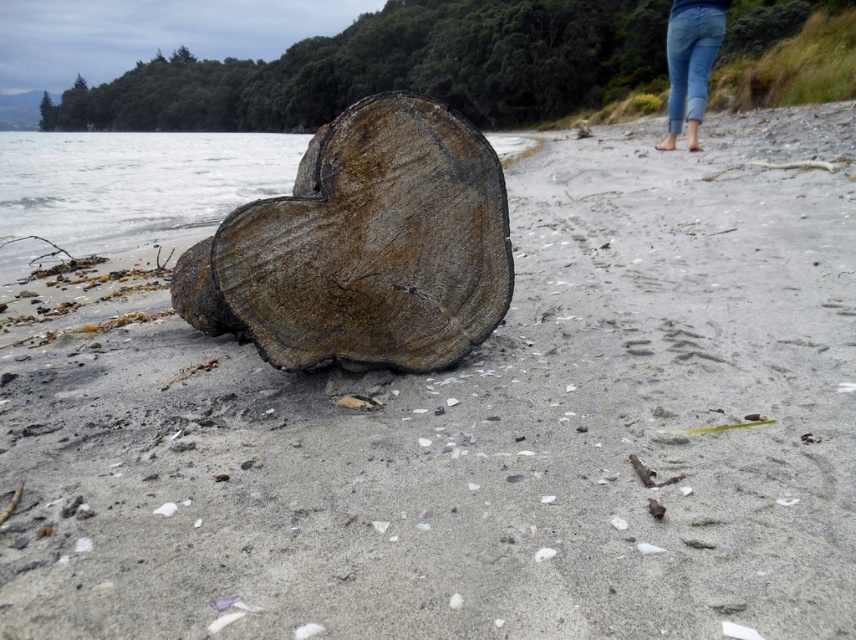
Question: In this image, where is rusty metallic heart at center located relative to blue denim jeans at upper right?

Choices:
 (A) above
 (B) below

Answer: (B)

Question: Which of the following is the closest to the observer?

Choices:
 (A) blue denim jeans at upper right
 (B) rusty metallic heart at center

Answer: (B)

Question: Can you confirm if rusty metallic heart at center is positioned below blue denim jeans at upper right?

Choices:
 (A) no
 (B) yes

Answer: (B)

Question: Can you confirm if rusty metallic heart at center is positioned above blue denim jeans at upper right?

Choices:
 (A) no
 (B) yes

Answer: (A)